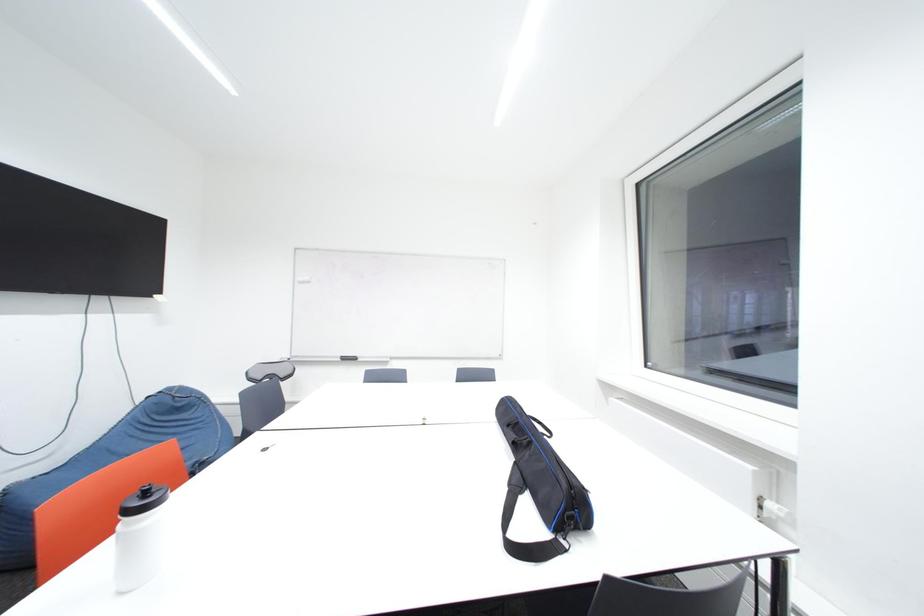
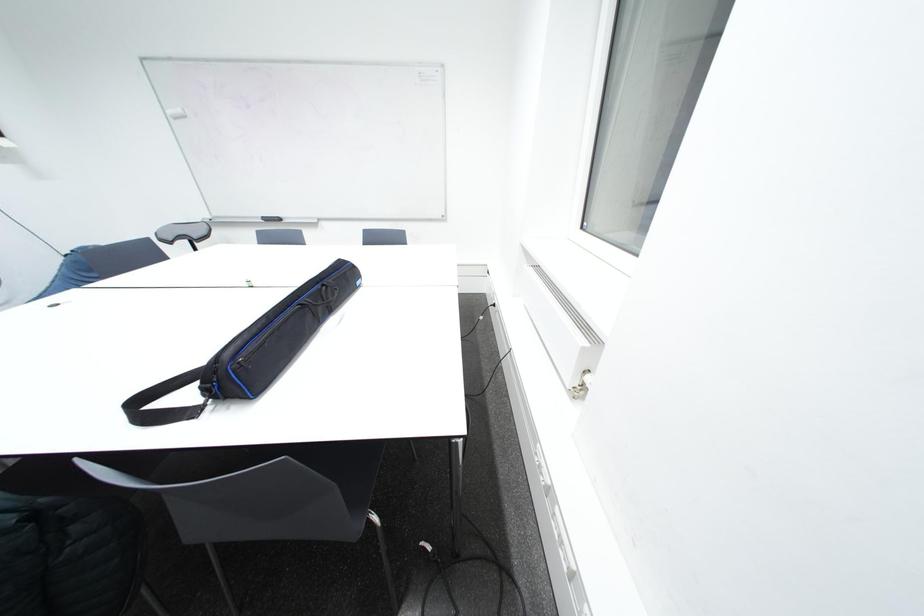
Question: How did the camera likely rotate?

Choices:
 (A) Left
 (B) Right
 (C) Up
 (D) Down

Answer: (D)